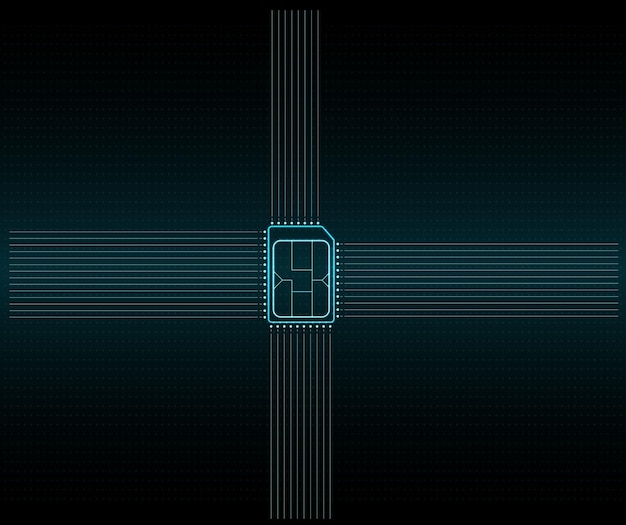
Identify the location of corners. Image resolution: width=626 pixels, height=525 pixels. (598, 15), (16, 506), (616, 509), (13, 13).